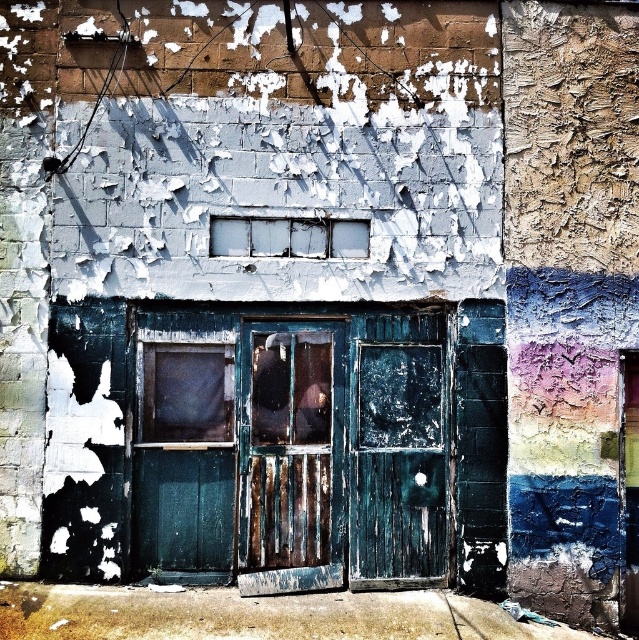
You are standing in front of the building and want to enter through the entrance. Which object, the rusty wood door at center or the white frosted glass window at center, should you interact with to gain access?

You should interact with the rusty wood door at center because it is closer to the viewer and likely the entrance, while the white frosted glass window at center is further away and probably part of the window above.